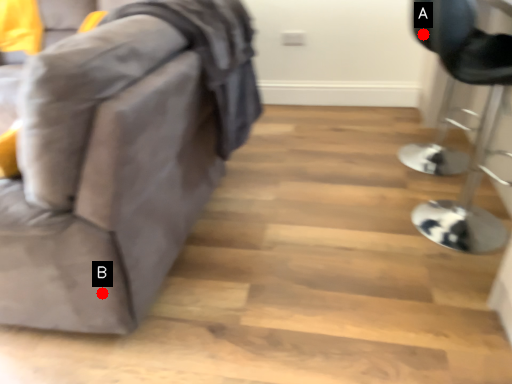
Question: Two points are circled on the image, labeled by A and B beside each circle. Which of the following is the farthest from the observer?

Choices:
 (A) A is further
 (B) B is further

Answer: (A)